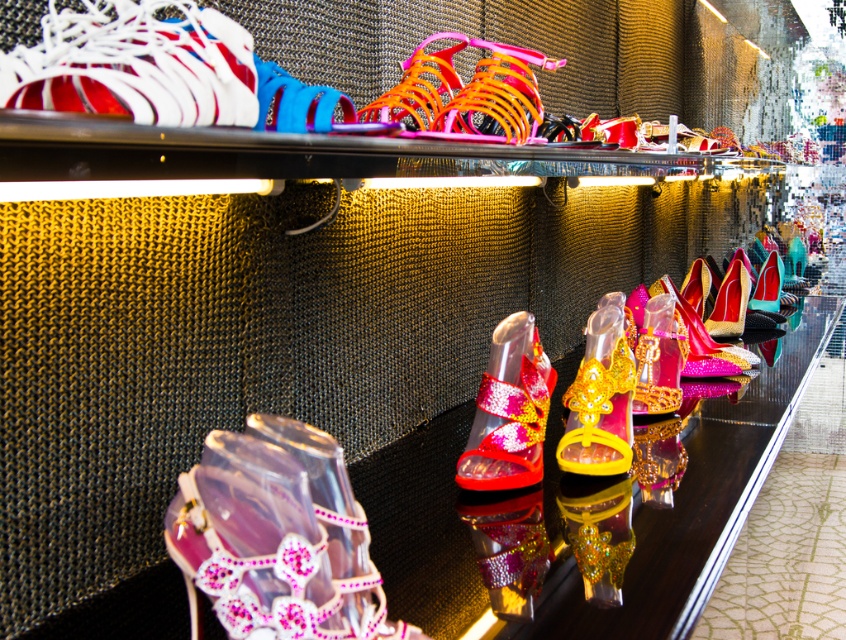
Question: Does white matte sandal at upper left have a smaller size compared to shiny gold sandal at center?

Choices:
 (A) yes
 (B) no

Answer: (A)

Question: Which point is farther from the camera taking this photo?

Choices:
 (A) tap(485, 554)
 (B) tap(569, 513)
 (C) tap(292, 556)
 (D) tap(608, 390)

Answer: (D)

Question: Is shiny pink glitter sandal at center bigger than shiny gold sandal at center?

Choices:
 (A) no
 (B) yes

Answer: (A)

Question: Considering the real-world distances, which object is farthest from the white matte sandal at upper left?

Choices:
 (A) shiny pink glitter sandal at center
 (B) shiny yellow plastic high-heeled shoe at center

Answer: (B)

Question: Is clear plastic sandal at lower left to the left of shiny pink glitter sandal at center from the viewer's perspective?

Choices:
 (A) no
 (B) yes

Answer: (B)

Question: Which object is the closest to the shiny multicolored high-heeled shoe at center?

Choices:
 (A) shiny gold sandal at center
 (B) shiny pink glitter sandal at center

Answer: (B)